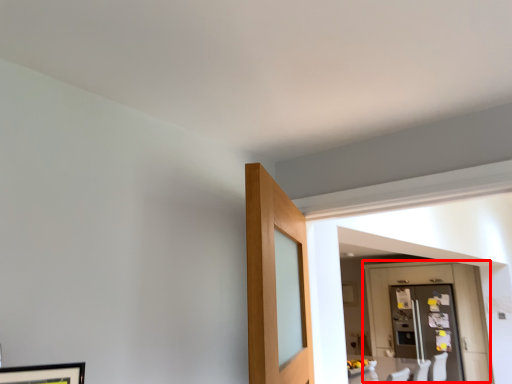
Question: From the image's perspective, considering the relative positions of door (annotated by the red box) and glass door in the image provided, where is door (annotated by the red box) located with respect to the staircase?

Choices:
 (A) above
 (B) below

Answer: (A)